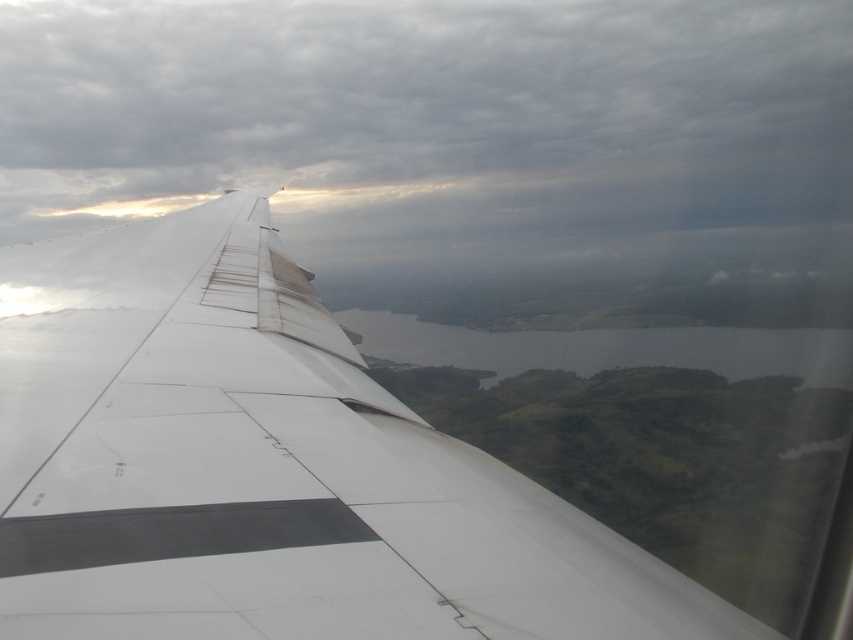
Question: Is cloudy gray sky at upper center in front of white matte wing at upper left?

Choices:
 (A) no
 (B) yes

Answer: (A)

Question: Considering the relative positions of cloudy gray sky at upper center and white matte wing at upper left in the image provided, where is cloudy gray sky at upper center located with respect to white matte wing at upper left?

Choices:
 (A) below
 (B) above

Answer: (B)

Question: Where is cloudy gray sky at upper center located in relation to white matte wing at upper left in the image?

Choices:
 (A) left
 (B) right

Answer: (B)